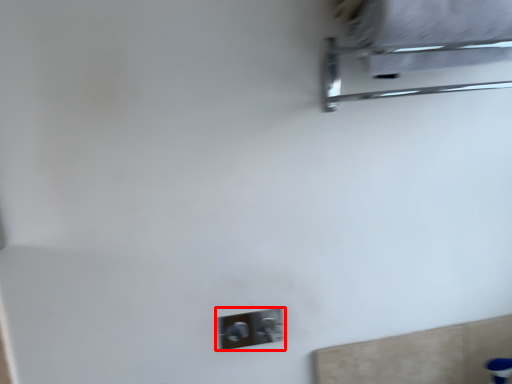
Question: Considering the relative positions of light switch (annotated by the red box) and furniture in the image provided, where is light switch (annotated by the red box) located with respect to the staircase?

Choices:
 (A) left
 (B) right

Answer: (A)